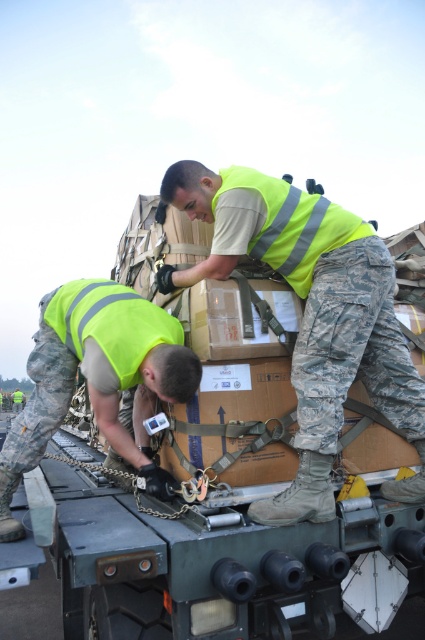
Question: Which object is positioned farthest from the yellow reflective vest at upper center?

Choices:
 (A) green camouflage trailer truck at center
 (B) yellow reflective vest at center

Answer: (A)

Question: Is green camouflage trailer truck at center positioned in front of yellow reflective vest at upper center?

Choices:
 (A) no
 (B) yes

Answer: (B)

Question: Based on their relative distances, which object is nearer to the yellow reflective vest at center?

Choices:
 (A) yellow reflective vest at upper center
 (B) green camouflage trailer truck at center

Answer: (B)

Question: In this image, where is green camouflage trailer truck at center located relative to yellow reflective vest at upper center?

Choices:
 (A) below
 (B) above

Answer: (A)

Question: Which point is closer to the camera?

Choices:
 (A) yellow reflective vest at center
 (B) green camouflage trailer truck at center

Answer: (B)

Question: Can you confirm if green camouflage trailer truck at center is thinner than yellow reflective vest at upper center?

Choices:
 (A) yes
 (B) no

Answer: (B)